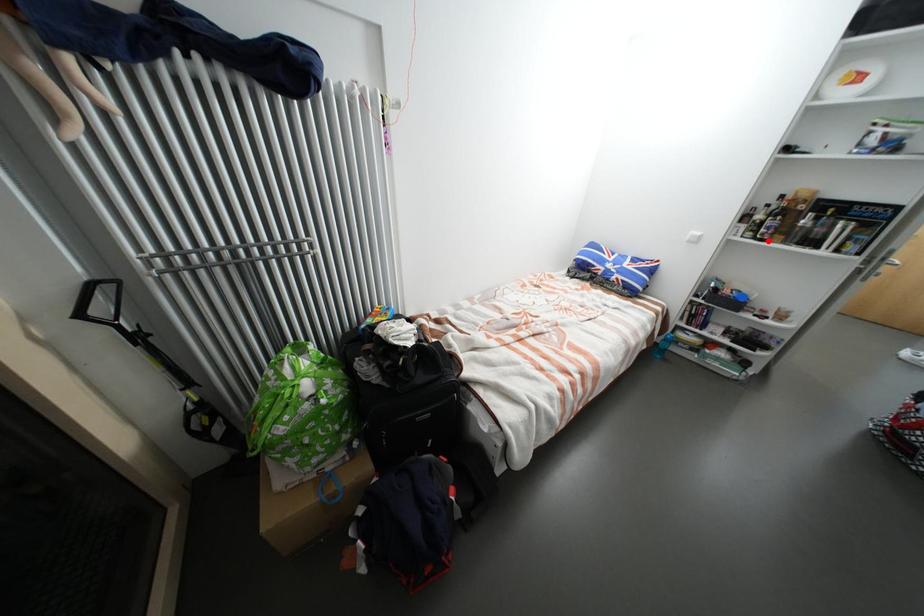
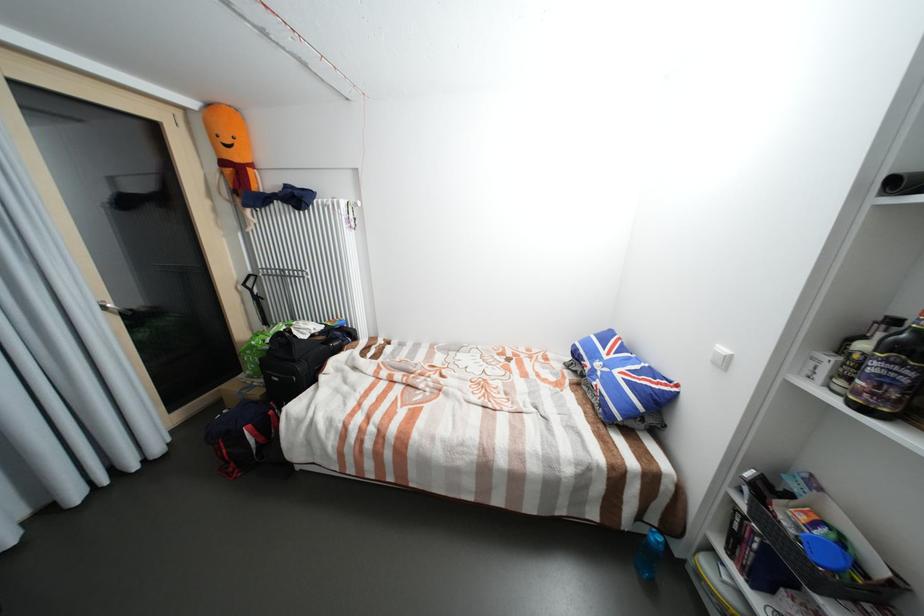
Find the pixel in the second image that matches the highlighted location in the first image.

(870, 410)